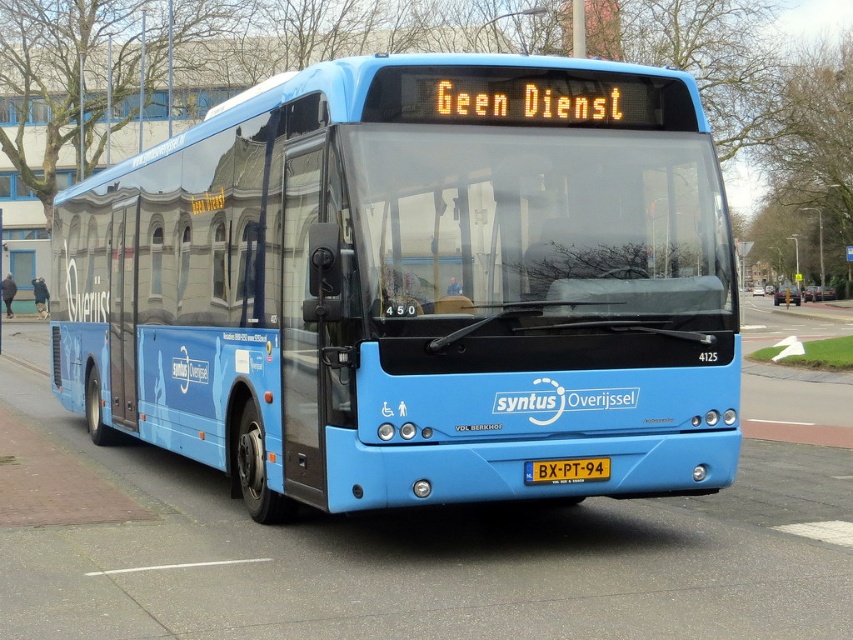
You are a delivery person who needs to unload a package from a truck that is 5 meters long. The truck is parked behind the matte blue bus at center. Can you safely back the truck up to the loading zone 6 meters ahead without hitting the bus?

The distance between the truck and the matte blue bus at center is 5.54 meters. Since the truck is 5 meters long, there is enough space to back up safely without hitting the bus.

In the scene shown: You are a driver approaching the matte blue bus at center and the yellow metallic license plate at center. Which object is closer to the left side of the road?

The matte blue bus at center is positioned on the left side of yellow metallic license plate at center, so it is closer to the left side of the road.